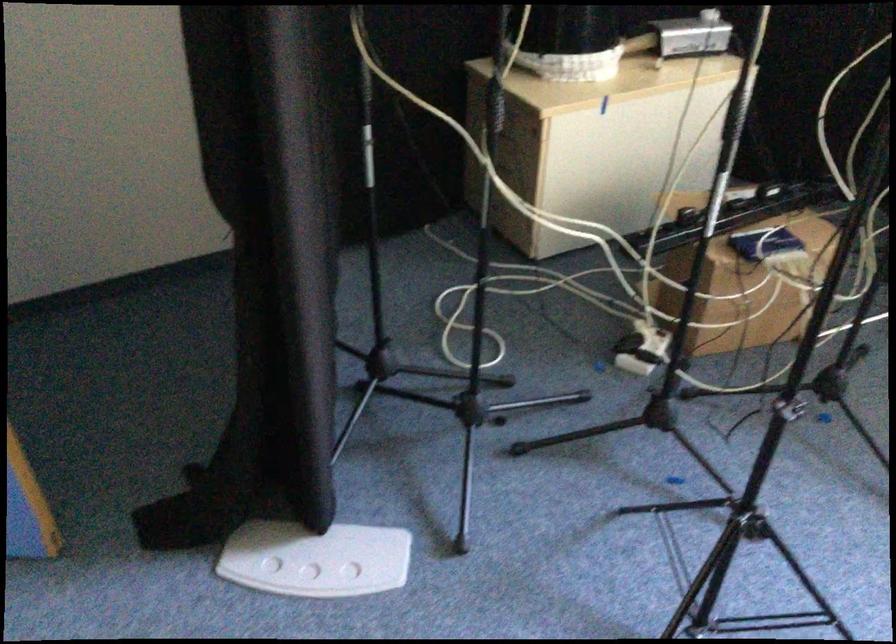
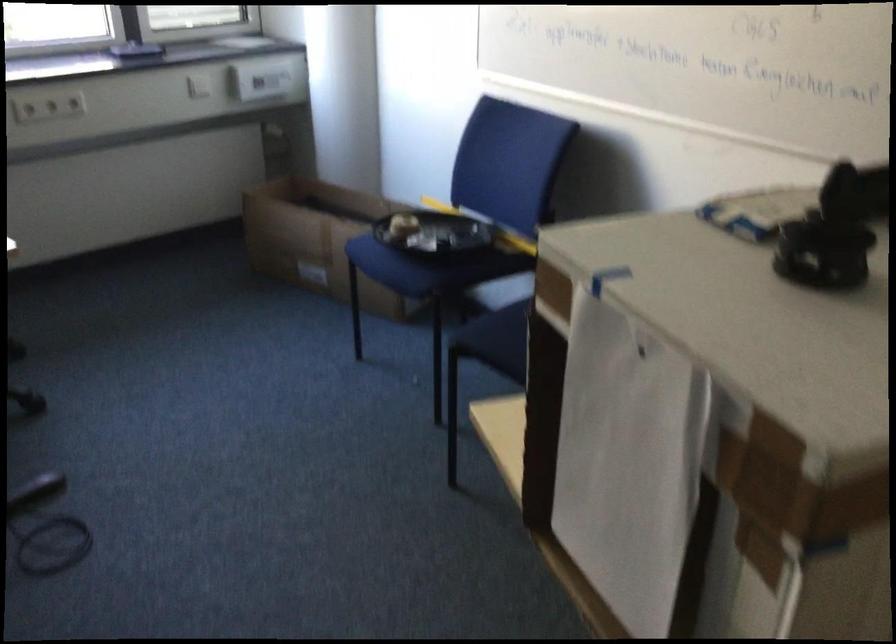
Consider the image. First-person continuous shooting, in which direction is the camera rotating?

The rotation direction of the camera is right-down.